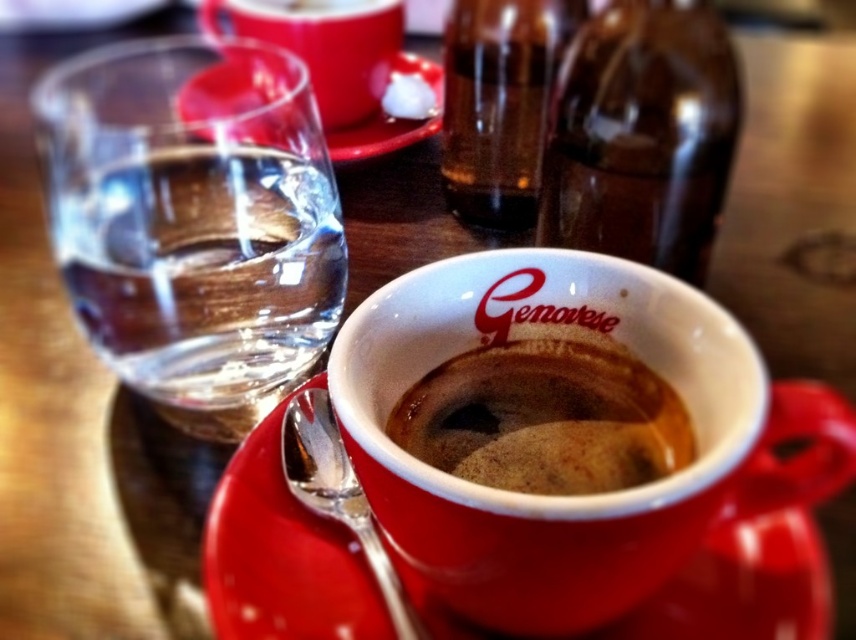
Question: Is brown glass bottle at upper center smaller than matte ceramic saucer at upper center?

Choices:
 (A) no
 (B) yes

Answer: (B)

Question: Does transparent glass at left have a larger size compared to brown matte coffee at center?

Choices:
 (A) yes
 (B) no

Answer: (A)

Question: Estimate the real-world distances between objects in this image. Which object is farther from the red glossy saucer at center?

Choices:
 (A) brown matte coffee at center
 (B) transparent glass at left

Answer: (B)

Question: Is transparent glass at left to the right of translucent glass bottle at center from the viewer's perspective?

Choices:
 (A) no
 (B) yes

Answer: (A)

Question: Which point appears closest to the camera in this image?

Choices:
 (A) (607, 113)
 (B) (247, 376)

Answer: (B)

Question: Which point is farther from the camera taking this photo?

Choices:
 (A) click(x=428, y=132)
 (B) click(x=241, y=20)

Answer: (A)